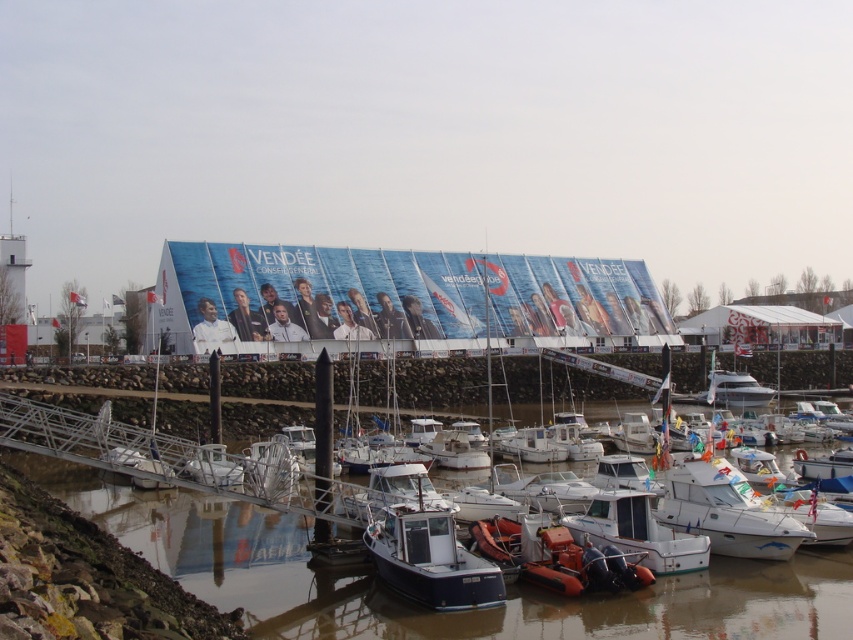
You are a dock attendant who needs to ensure that all boats are spaced properly. Given that the blue matte boat at center and the white plastic boat at center are both docked at the center, which boat requires more space between them to prevent collision?

The white plastic boat at center requires more space between them to prevent collision because it has a greater width than the blue matte boat at center.

You are standing at the edge of the marina and notice a point marked at coordinates [422,609]. What is the condition of the water at that location?

The point at coordinates [422,609] indicates smooth water at lower center, so the water there is calm and free of disturbances.

You are a photographer planning to capture a reflection shot of the blue matte boat at center. Since the smooth water at lower center is essential for the reflection, would the height difference between them affect the reflection quality?

The smooth water at lower center has a greater height compared to the blue matte boat at center. This means the water is higher than the boat, which could disrupt the reflection quality as the water level might not align properly with the boat for a clear reflection.